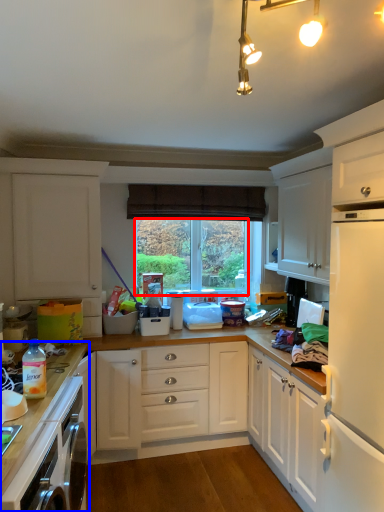
Question: Which point is closer to the camera, window screen (highlighted by a red box) or countertop (highlighted by a blue box)?

Choices:
 (A) window screen
 (B) countertop

Answer: (B)